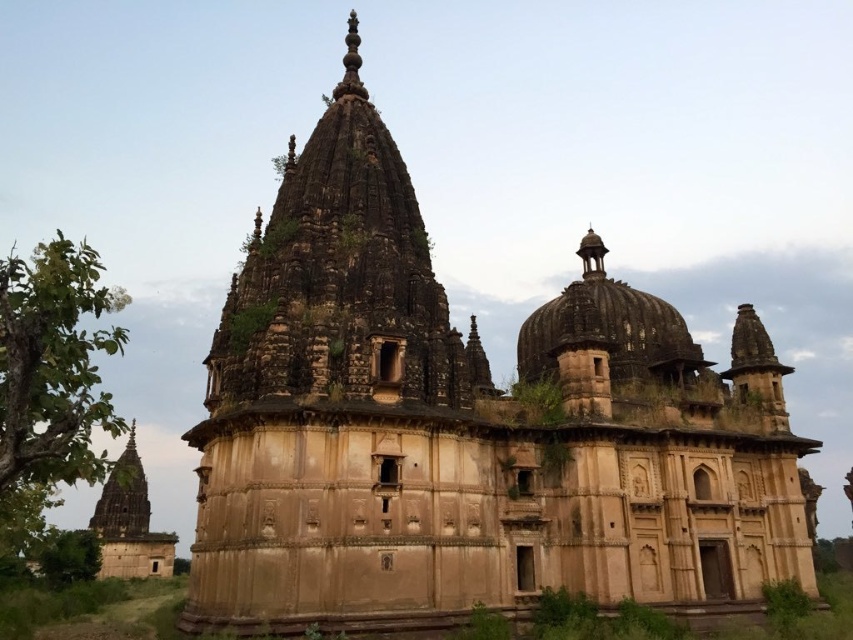
You are an architect examining the temple structure. You need to determine the spatial relationship between the brown stone dome at center and the brown stone tower at lower left. Is the dome positioned above or below the tower?

The brown stone dome at center is located above the brown stone tower at lower left.

You are an architect examining the temple structure. You need to determine which of the two brown stone structures, the brown stone dome at center or the brown stone tower at lower left, is larger in size. Based on the scene description, which one is bigger?

The brown stone tower at lower left is larger than the brown stone dome at center.